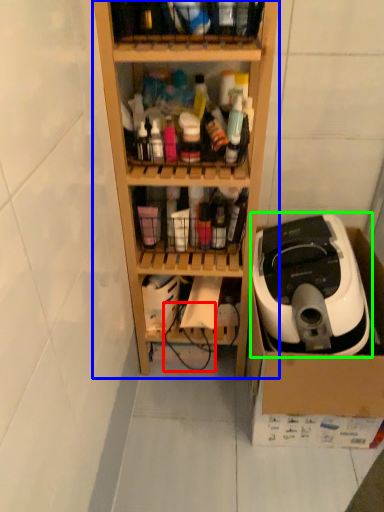
Question: Which object is positioned closest to wire (highlighted by a red box)? Select from shelf (highlighted by a blue box) and home appliance (highlighted by a green box).

Choices:
 (A) shelf
 (B) home appliance

Answer: (A)